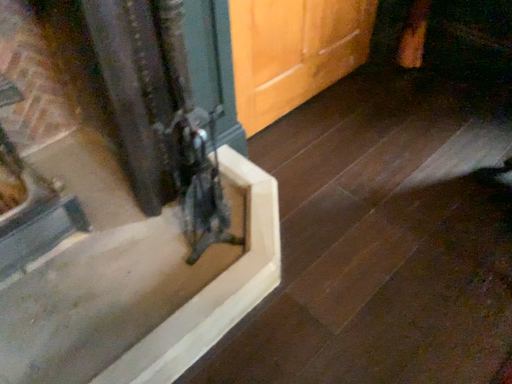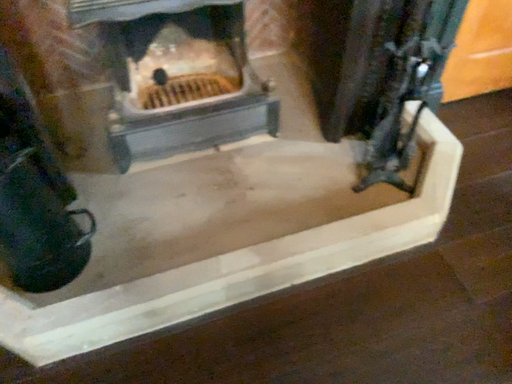
Question: How did the camera likely rotate when shooting the video?

Choices:
 (A) rotated right
 (B) rotated left

Answer: (B)